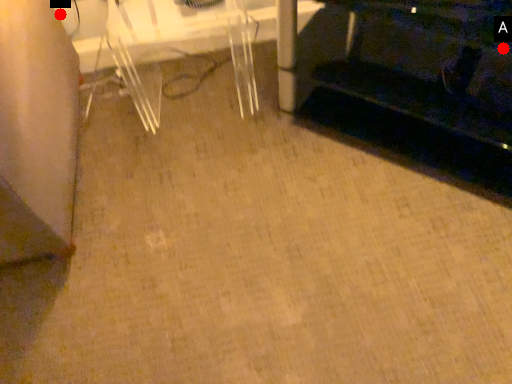
Question: Two points are circled on the image, labeled by A and B beside each circle. Which point appears closest to the camera in this image?

Choices:
 (A) A is closer
 (B) B is closer

Answer: (A)